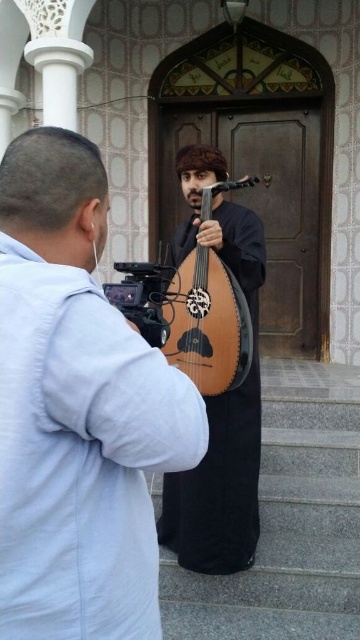
Is the wooden lute at center wider than the wooden at center?

The wooden lute at center is wider than the wooden at center according to the description.

Consider the image. You are a performer carrying a 1.2 meter long traditional instrument. You want to stand between the matte black instrument at center and the wooden at center. Is there enough space for you to fit between them?

The distance between the matte black instrument at center and the wooden at center is 1.13 meters, which is slightly less than the 1.2 meter length of your instrument. Therefore, there is not enough space to fit your instrument between them.